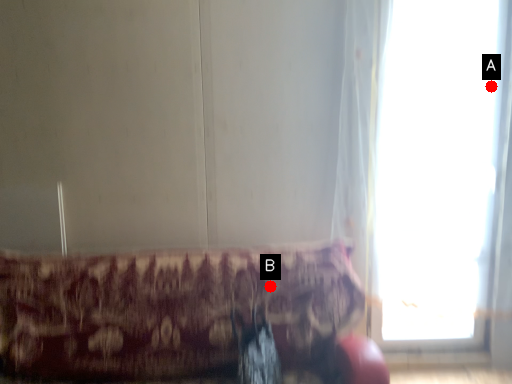
Question: Two points are circled on the image, labeled by A and B beside each circle. Which point is further to the camera?

Choices:
 (A) A is further
 (B) B is further

Answer: (A)